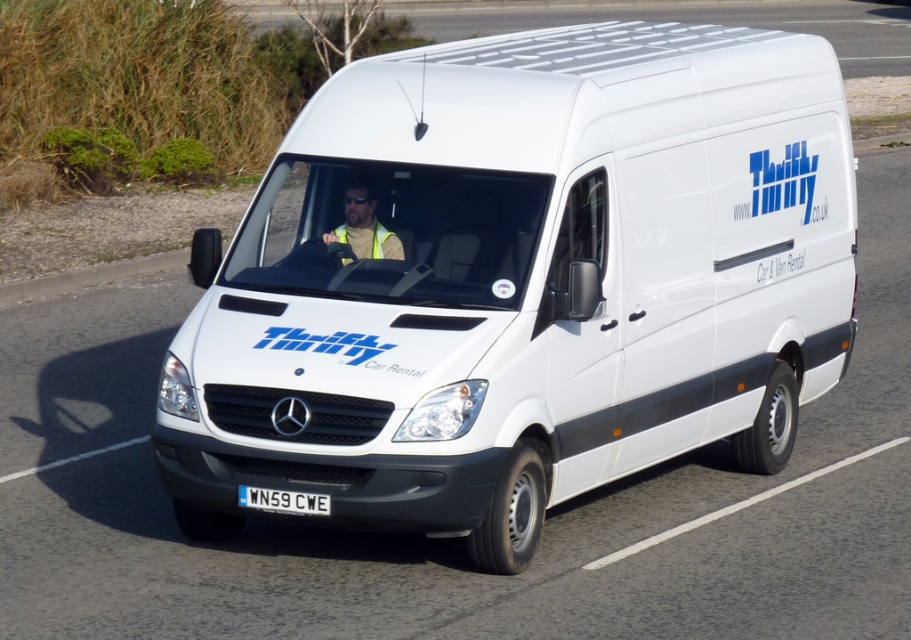
Can you confirm if white matte van at center is positioned to the left of white plastic license plate at center?

In fact, white matte van at center is to the right of white plastic license plate at center.

Who is positioned more to the left, white matte van at center or white plastic license plate at center?

From the viewer's perspective, white plastic license plate at center appears more on the left side.

Find the location of `white matte van at center`. white matte van at center is located at coordinates (521, 282).

Describe the element at coordinates (363, 225) in the screenshot. I see `yellow reflective vest at center` at that location.

Find the location of a particular element. yellow reflective vest at center is located at coordinates (363, 225).

Describe the element at coordinates (363, 225) in the screenshot. I see `yellow reflective vest at center` at that location.

This screenshot has height=640, width=911. I want to click on yellow reflective vest at center, so click(x=363, y=225).

Does white matte van at center appear on the right side of yellow reflective vest at center?

Yes, white matte van at center is to the right of yellow reflective vest at center.

Is point (587, 160) positioned after point (362, 204)?

No, (587, 160) is closer to viewer.

Which is in front, point (417, 461) or point (357, 196)?

Positioned in front is point (417, 461).

In order to click on white matte van at center in this screenshot , I will do `click(521, 282)`.